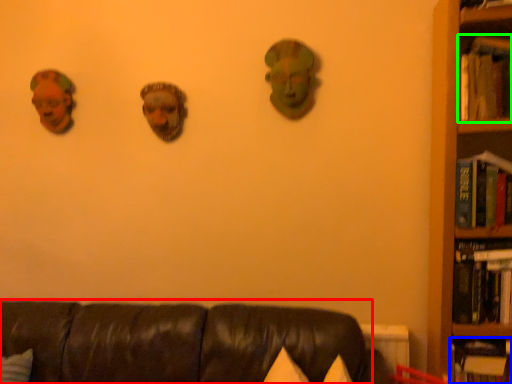
Question: Which object is the closest to the studio couch (highlighted by a red box)? Choose among these: book (highlighted by a blue box) or book (highlighted by a green box).

Choices:
 (A) book
 (B) book

Answer: (A)